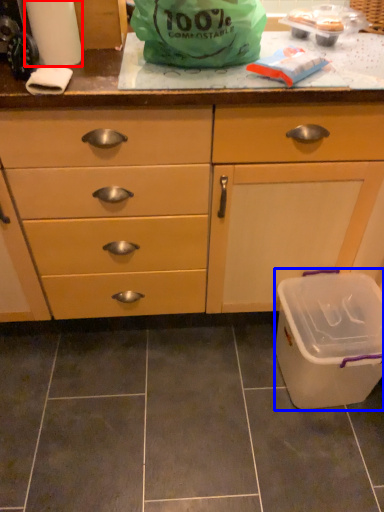
Question: Among these objects, which one is farthest to the camera, paper towel (highlighted by a red box) or recycling bin (highlighted by a blue box)?

Choices:
 (A) paper towel
 (B) recycling bin

Answer: (B)